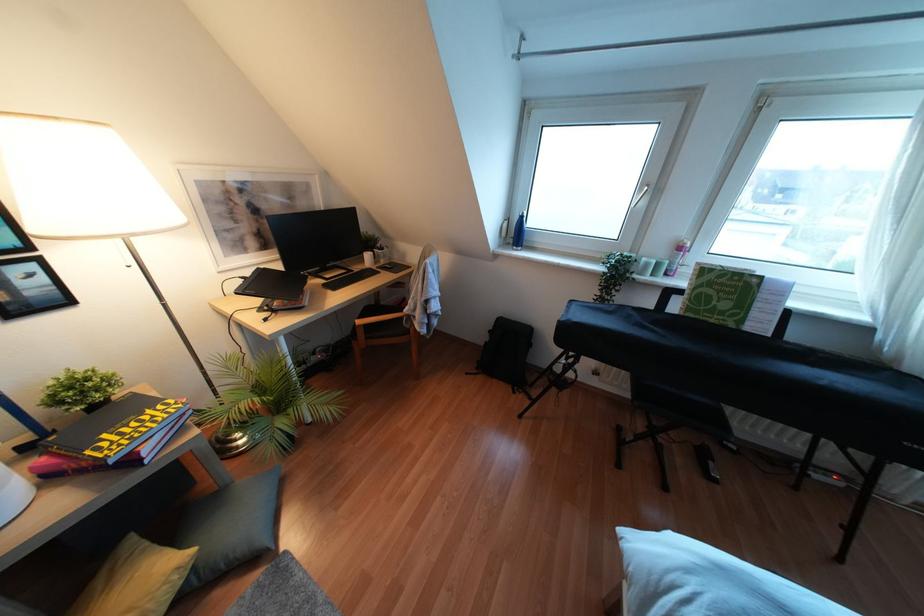
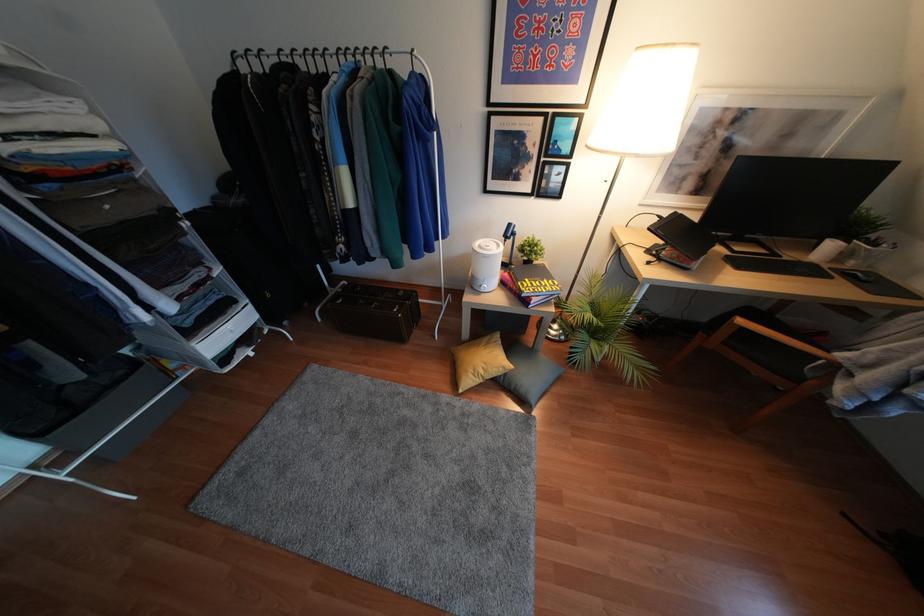
Where in the second image is the point corresponding to the point at 358,321 from the first image?

(739, 321)